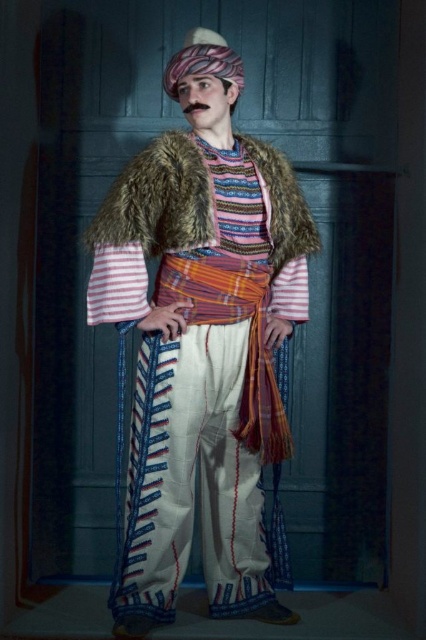
Which is more to the left, striped woolen shirt at center or fuzzy brown fur coat at center?

Positioned to the left is striped woolen shirt at center.

Identify the location of striped woolen shirt at center. The width and height of the screenshot is (426, 640). (201, 340).